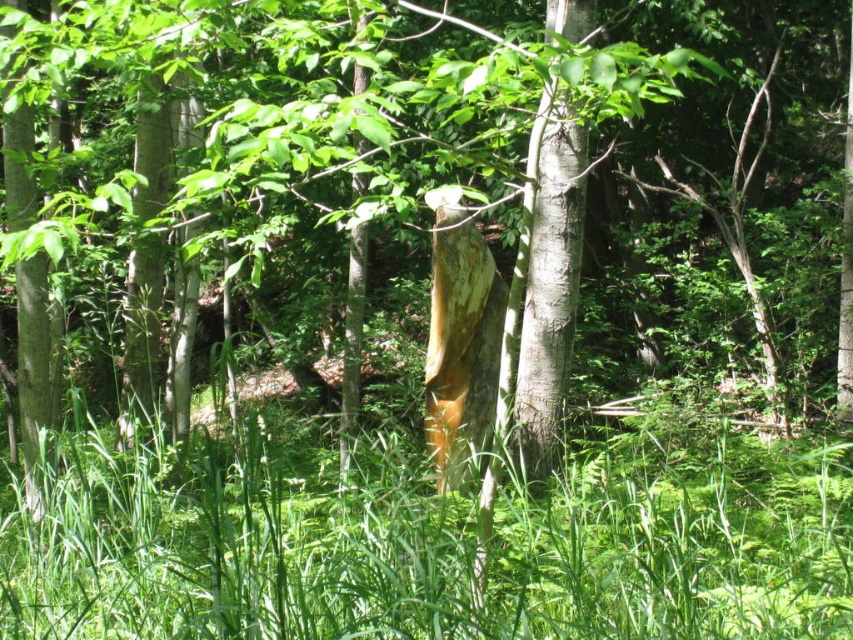
Which of these two, green grass at center or smooth white tree trunk at center, stands taller?

smooth white tree trunk at center

Does green grass at center appear on the left side of smooth white tree trunk at center?

Indeed, green grass at center is positioned on the left side of smooth white tree trunk at center.

Which is in front, point (195, 570) or point (570, 38)?

Point (195, 570) is in front.

Locate an element on the screen. The image size is (853, 640). green grass at center is located at coordinates (434, 545).